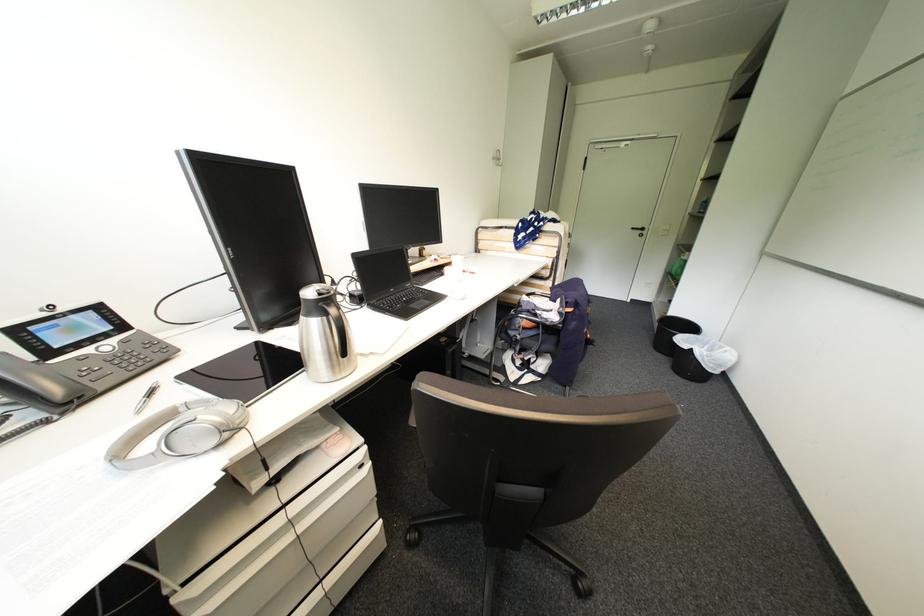
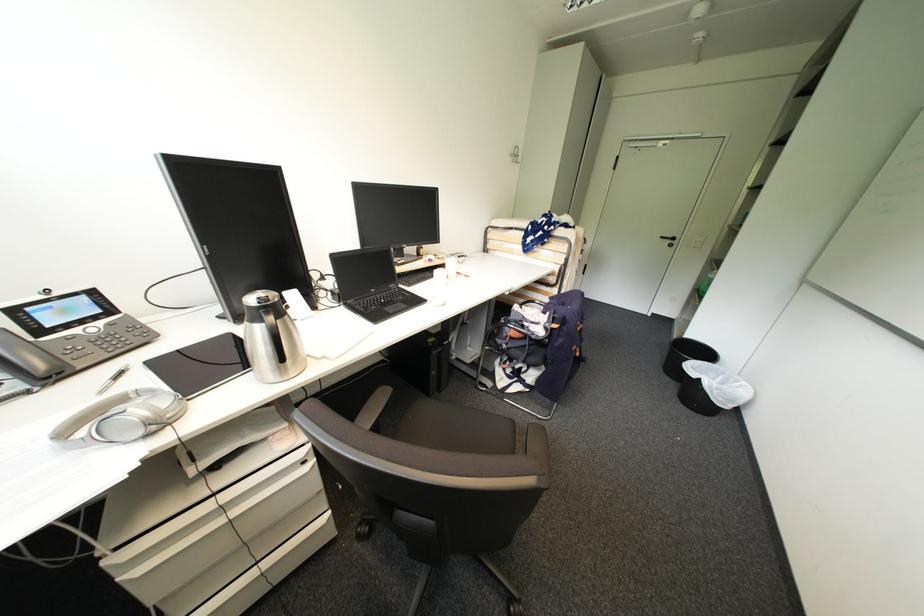
The point at (456, 262) is marked in the first image. Where is the corresponding point in the second image?

(451, 264)